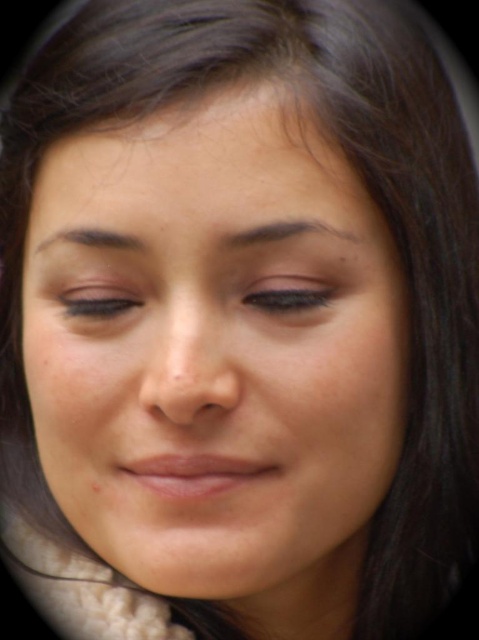
Question: Which object is closer to the camera taking this photo?

Choices:
 (A) matte black eye at upper center
 (B) matte black eye at center
 (C) smooth skin face at center

Answer: (C)

Question: Is matte black eye at upper center above matte black eye at center?

Choices:
 (A) yes
 (B) no

Answer: (A)

Question: Which object is the farthest from the matte black eye at upper center?

Choices:
 (A) smooth skin face at center
 (B) matte black eye at center

Answer: (A)

Question: Can you confirm if matte black eye at upper center is positioned to the right of matte black eye at center?

Choices:
 (A) yes
 (B) no

Answer: (A)

Question: Based on their relative distances, which object is farther from the smooth skin face at center?

Choices:
 (A) matte black eye at upper center
 (B) matte black eye at center

Answer: (B)

Question: From the image, what is the correct spatial relationship of smooth skin face at center in relation to matte black eye at upper center?

Choices:
 (A) left
 (B) right

Answer: (A)